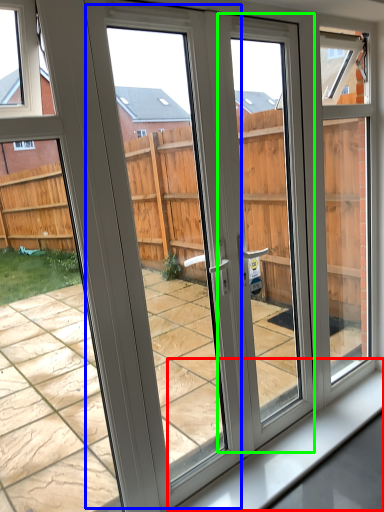
Question: Which is nearer to the window sill (highlighted by a red box)? screen door (highlighted by a blue box) or screen door (highlighted by a green box).

Choices:
 (A) screen door
 (B) screen door

Answer: (B)